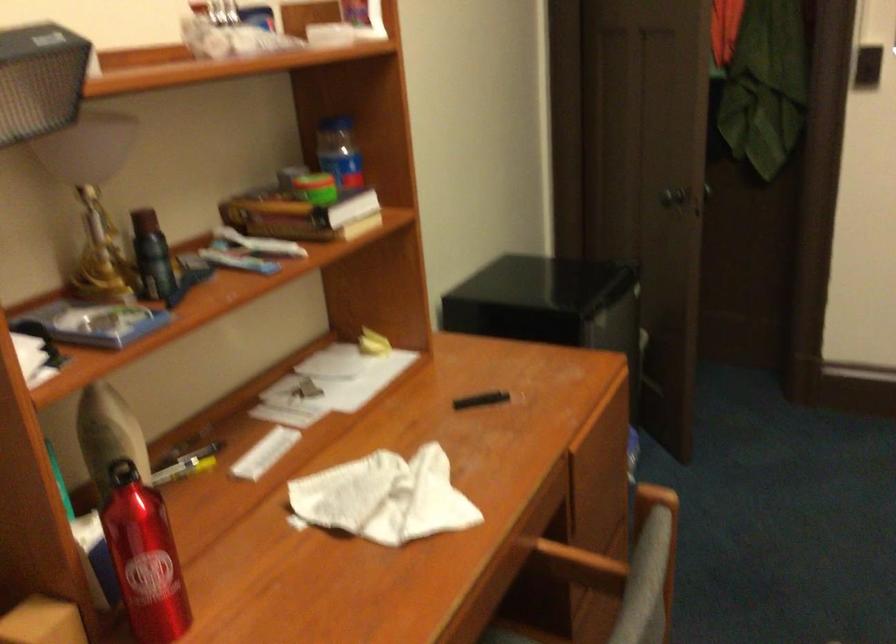
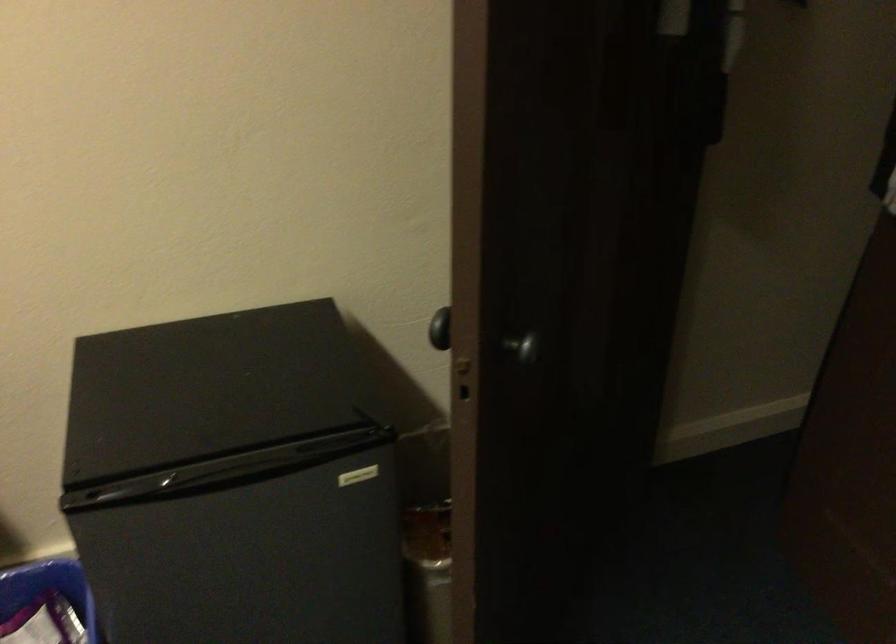
Question: I am providing you with two images of the same scene from different viewpoints. Please identify which objects are invisible in image2.

Choices:
 (A) fridge door handle
 (B) blue wastebasket
 (C) door knob
 (D) black door knob

Answer: (C)